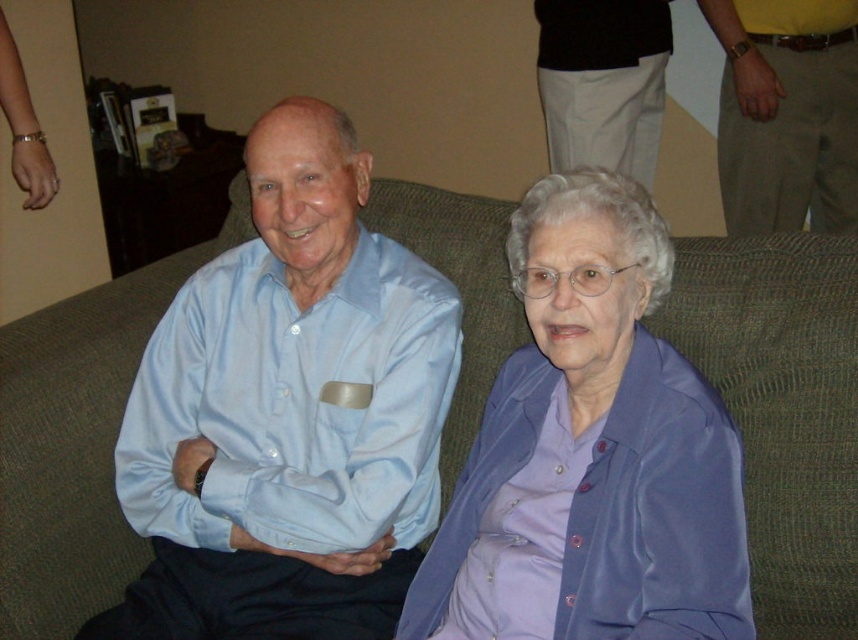
Between point (0, 362) and point (609, 541), which one is positioned behind?

Positioned behind is point (0, 362).

Can you confirm if green fabric couch at center is bigger than purple satin blouse at center?

Correct, green fabric couch at center is larger in size than purple satin blouse at center.

The height and width of the screenshot is (640, 858). I want to click on green fabric couch at center, so click(x=783, y=410).

Where is `green fabric couch at center`? green fabric couch at center is located at coordinates (783, 410).

Is light blue satin shirt at center to the left of purple satin blouse at center from the viewer's perspective?

Indeed, light blue satin shirt at center is positioned on the left side of purple satin blouse at center.

Which is below, light blue satin shirt at center or purple satin blouse at center?

Positioned lower is purple satin blouse at center.

Does point (329, 246) lie behind point (601, 432)?

Yes, point (329, 246) is behind point (601, 432).

The image size is (858, 640). Identify the location of light blue satin shirt at center. (288, 413).

Does light blue satin shirt at center have a lesser width compared to green fabric couch at center?

Indeed, light blue satin shirt at center has a lesser width compared to green fabric couch at center.

Is point (390, 401) more distant than point (713, 362)?

No, (390, 401) is closer to viewer.

Locate an element on the screen. The width and height of the screenshot is (858, 640). light blue satin shirt at center is located at coordinates (288, 413).